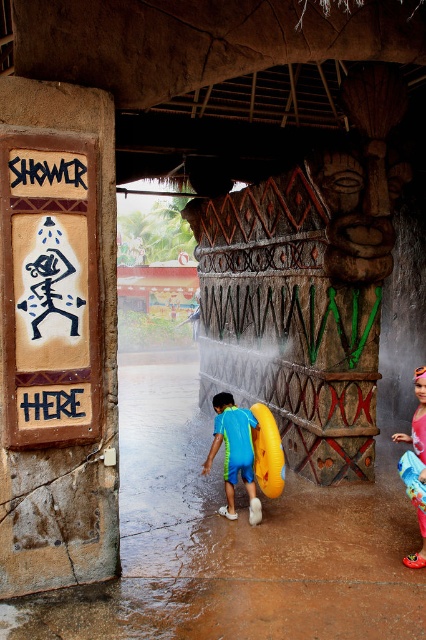
Who is taller, blue rubber ring at center or fluorescent pink rubber boots at lower right?

blue rubber ring at center is taller.

What do you see at coordinates (235, 452) in the screenshot? Image resolution: width=426 pixels, height=640 pixels. I see `blue rubber ring at center` at bounding box center [235, 452].

Between point (250, 460) and point (420, 378), which one is positioned in front?

Point (420, 378) is more forward.

Find the location of `blue rubber ring at center`. blue rubber ring at center is located at coordinates (235, 452).

Is matte brown sign at left thinner than blue rubber ring at center?

Incorrect, matte brown sign at left's width is not less than blue rubber ring at center's.

Consider the image. Can you confirm if matte brown sign at left is bigger than blue rubber ring at center?

Indeed, matte brown sign at left has a larger size compared to blue rubber ring at center.

Where is `matte brown sign at left`? matte brown sign at left is located at coordinates (58, 522).

This screenshot has width=426, height=640. In order to click on matte brown sign at left in this screenshot , I will do `click(58, 522)`.

Is blue rubber ring at center above black wood sign at upper left?

Actually, blue rubber ring at center is below black wood sign at upper left.

Is point (216, 442) less distant than point (57, 179)?

No, (216, 442) is further to viewer.

Where is `blue rubber ring at center`? blue rubber ring at center is located at coordinates (235, 452).